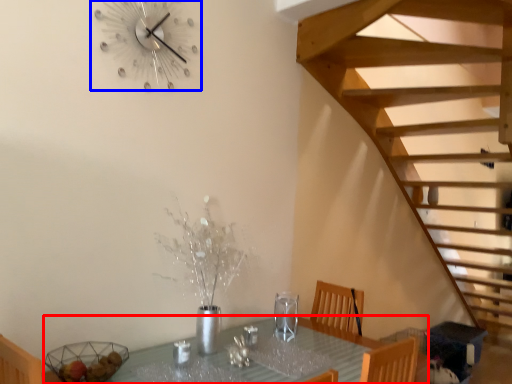
Question: Among these objects, which one is nearest to the camera, table (highlighted by a red box) or wall clock (highlighted by a blue box)?

Choices:
 (A) table
 (B) wall clock

Answer: (A)